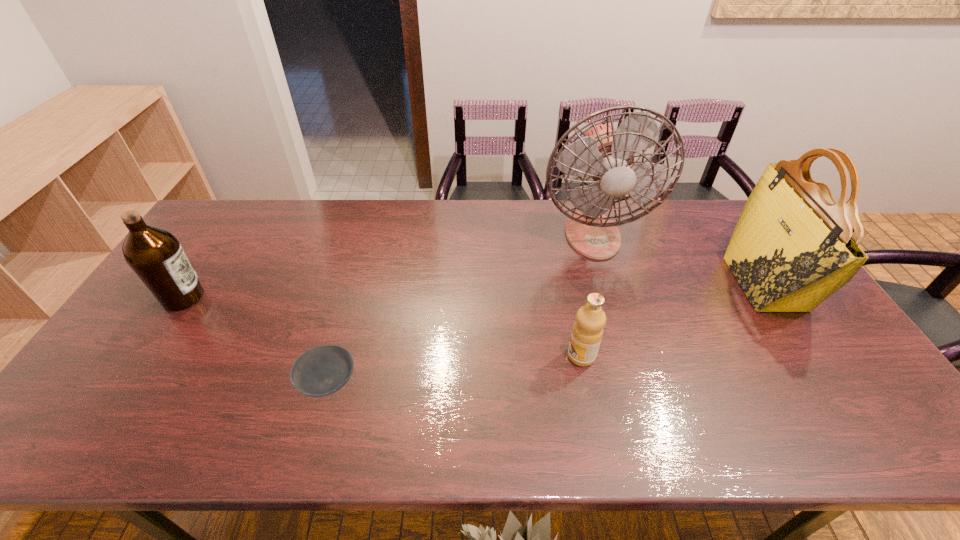
Where is `vacant point located between the rightmost object and the shorter olive oil`? The image size is (960, 540). vacant point located between the rightmost object and the shorter olive oil is located at coordinates (673, 320).

At what (x,y) coordinates should I click in order to perform the action: click on vacant point located between the shortest object and the farther olive oil. Please return your answer as a coordinate pair (x, y). The height and width of the screenshot is (540, 960). Looking at the image, I should click on (255, 340).

Locate an element on the screen. The width and height of the screenshot is (960, 540). empty location between the fourth object from right to left and the third tallest object is located at coordinates click(255, 340).

The height and width of the screenshot is (540, 960). In order to click on vacant space that is in between the shortest object and the rightmost object in this screenshot , I will do (546, 333).

I want to click on vacant space that is in between the fan and the left olive oil, so click(x=388, y=266).

In order to click on empty location between the left olive oil and the bowl in this screenshot , I will do `click(255, 340)`.

Find the location of a particular element. free point between the second object from left to right and the leftmost object is located at coordinates (255, 340).

Identify the location of empty location between the tote bag and the bowl. (546, 333).

Where is `object that stands as the third closest to the second object from left to right`? object that stands as the third closest to the second object from left to right is located at coordinates (605, 154).

This screenshot has height=540, width=960. In order to click on the fourth closest object to the taller olive oil in this screenshot , I will do `click(793, 246)`.